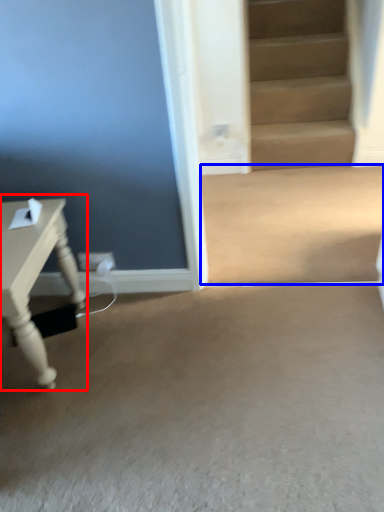
Question: Which of the following is the closest to the observer, table (highlighted by a red box) or concrete (highlighted by a blue box)?

Choices:
 (A) table
 (B) concrete

Answer: (A)